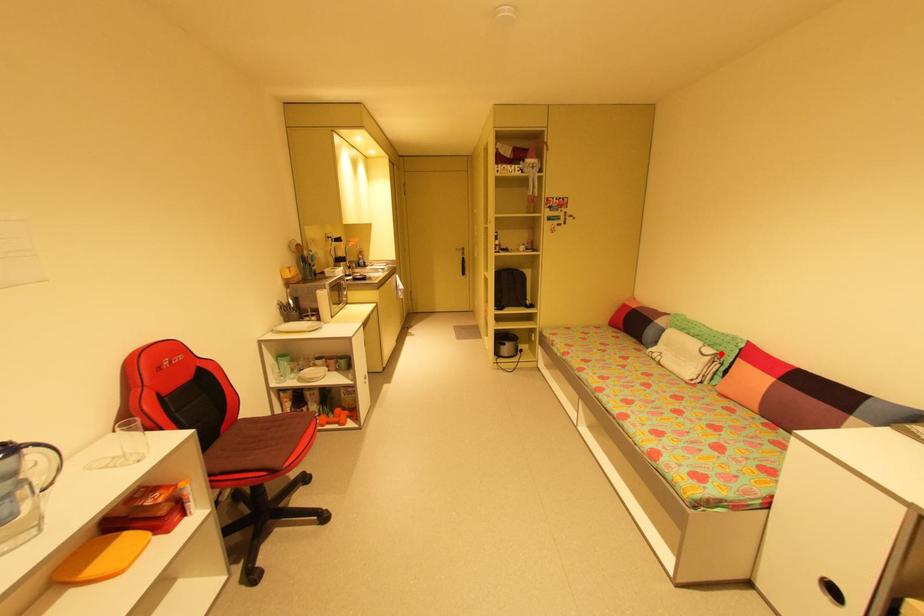
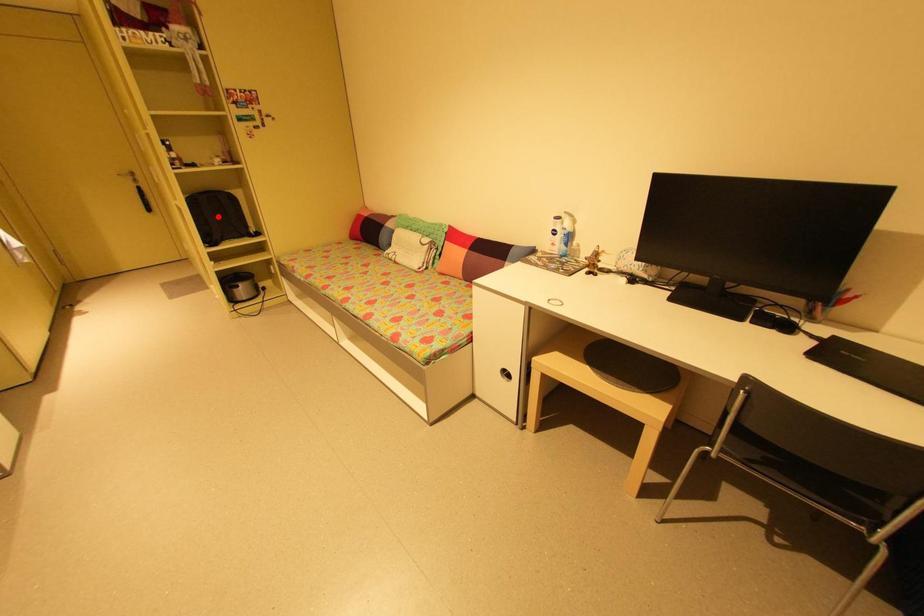
I am providing you with two images of the same scene from different viewpoints. A red point is marked on the first image and another point is marked on the second image. Does the point marked in image1 correspond to the same location as the one in image2?

No